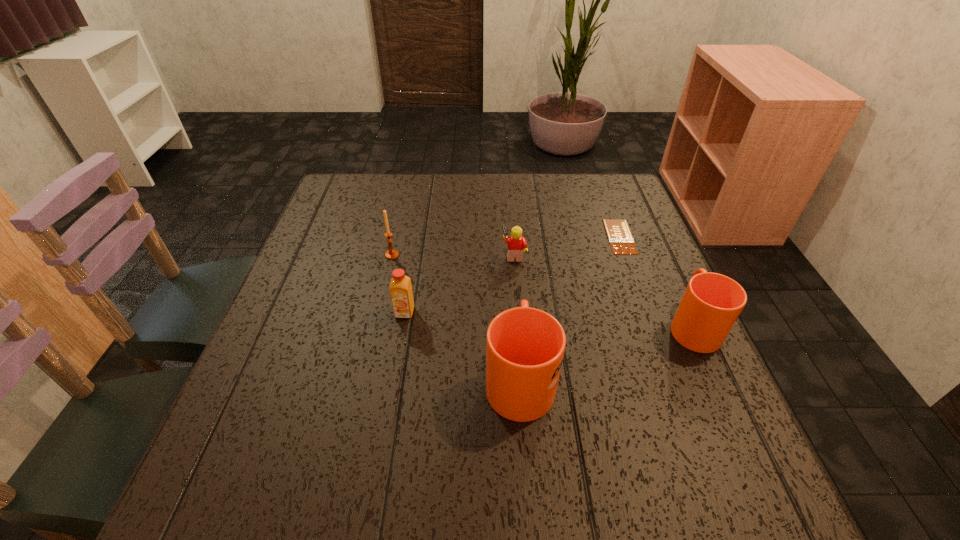
Locate an element on the screen. vacant space located 0.280m on the handle side of the right mug is located at coordinates (646, 226).

What are the coordinates of `vacant space located on the handle side of the right mug` in the screenshot? It's located at (643, 219).

Identify the location of vacant region located 0.250m in front of the second shortest object with the accessory visible. (402, 254).

The width and height of the screenshot is (960, 540). I want to click on blank area located 0.080m in front of the second shortest object with the accessory visible, so click(469, 254).

Where is `free space located in front of the second shortest object with the accessory visible`? This screenshot has width=960, height=540. free space located in front of the second shortest object with the accessory visible is located at coordinates (462, 254).

Image resolution: width=960 pixels, height=540 pixels. Identify the location of vacant space situated 0.220m on the right of the leftmost object. (487, 255).

Locate an element on the screen. The image size is (960, 540). vacant point located on the front of the shortest object is located at coordinates (636, 280).

The height and width of the screenshot is (540, 960). I want to click on free location located 0.220m on the front and back of the second object from left to right, so click(x=388, y=412).

This screenshot has width=960, height=540. I want to click on object that is at the near edge, so click(525, 346).

Identify the location of mug that is positioned at the right edge. This screenshot has height=540, width=960. (711, 304).